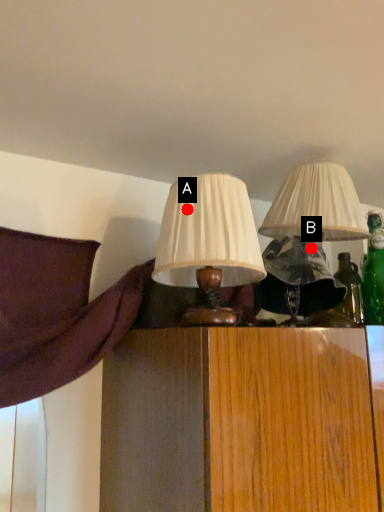
Question: Two points are circled on the image, labeled by A and B beside each circle. Which point is closer to the camera taking this photo?

Choices:
 (A) A is closer
 (B) B is closer

Answer: (A)